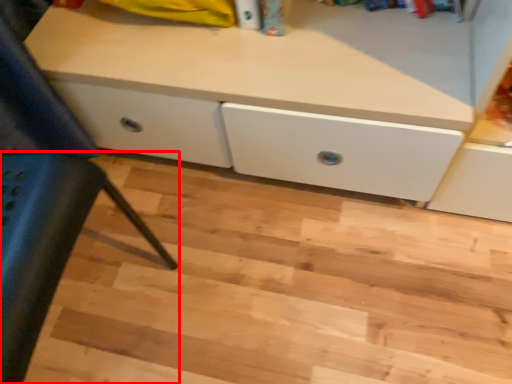
Question: Where is furniture (annotated by the red box) located in relation to stair in the image?

Choices:
 (A) right
 (B) left

Answer: (B)